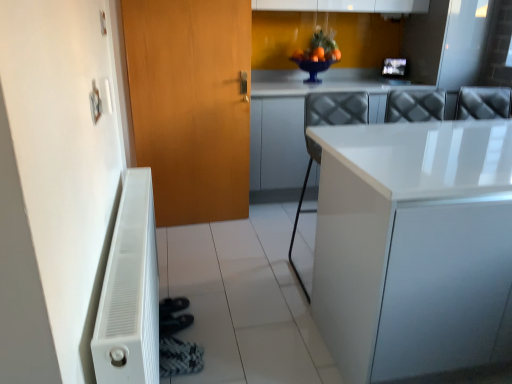
Image resolution: width=512 pixels, height=384 pixels. I want to click on vacant space positioned to the left of white glossy chair at center, so click(x=253, y=281).